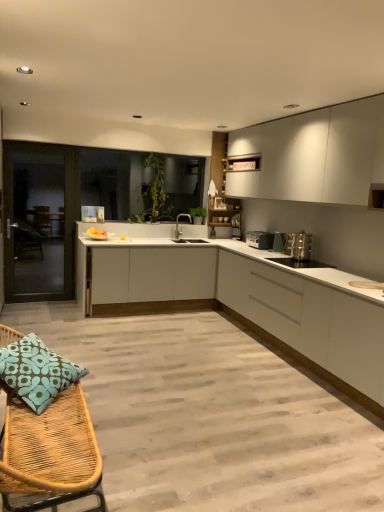
I want to click on vacant area that is situated to the right of woven wood bench at lower left, so click(202, 464).